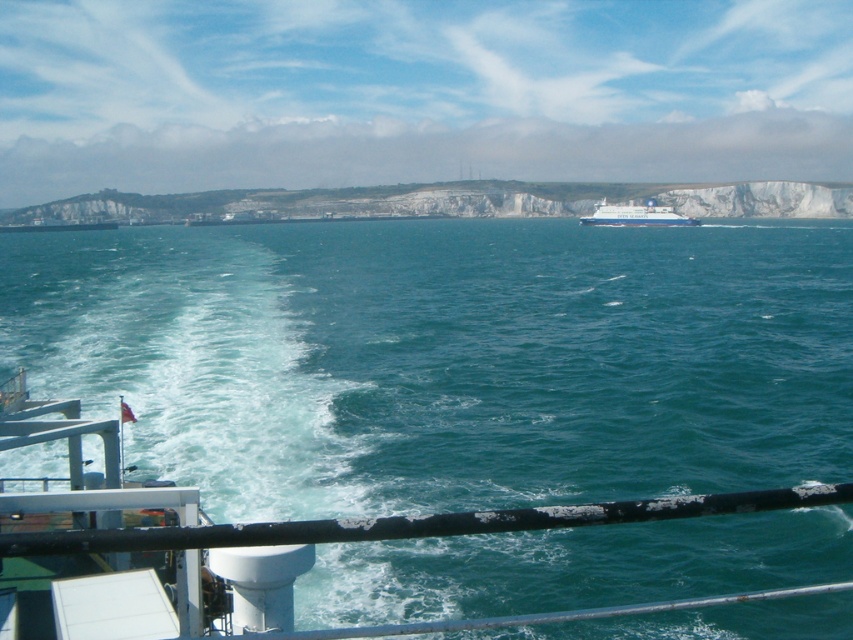
Question: Which point is closer to the camera?

Choices:
 (A) (196, 316)
 (B) (622, 211)

Answer: (A)

Question: Which point appears closest to the camera in this image?

Choices:
 (A) (610, 218)
 (B) (252, 410)

Answer: (B)

Question: Is clear blue water at center closer to the viewer compared to white glossy cruise ship at center?

Choices:
 (A) yes
 (B) no

Answer: (A)

Question: Where is clear blue water at center located in relation to white glossy cruise ship at center in the image?

Choices:
 (A) right
 (B) left

Answer: (B)

Question: Is clear blue water at center below white glossy cruise ship at center?

Choices:
 (A) yes
 (B) no

Answer: (A)